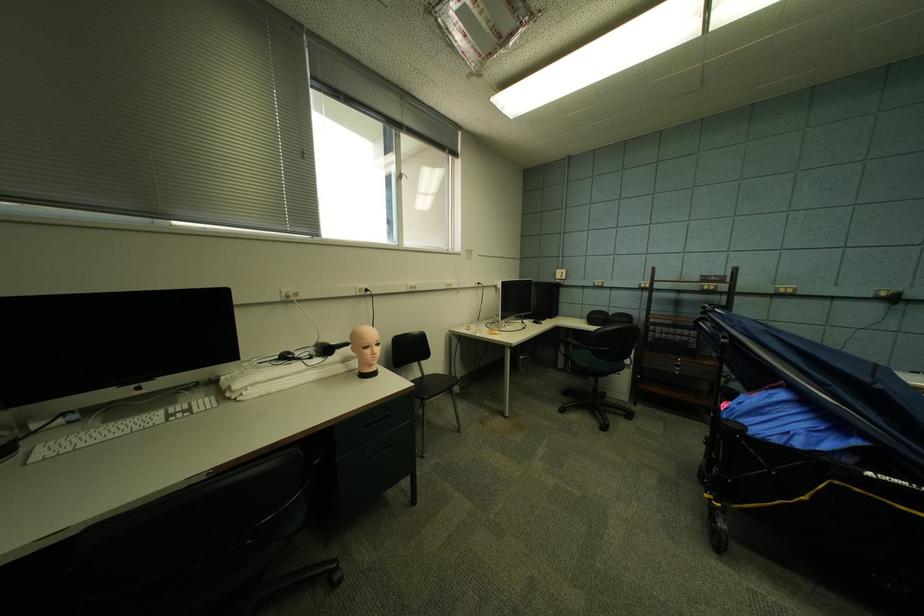
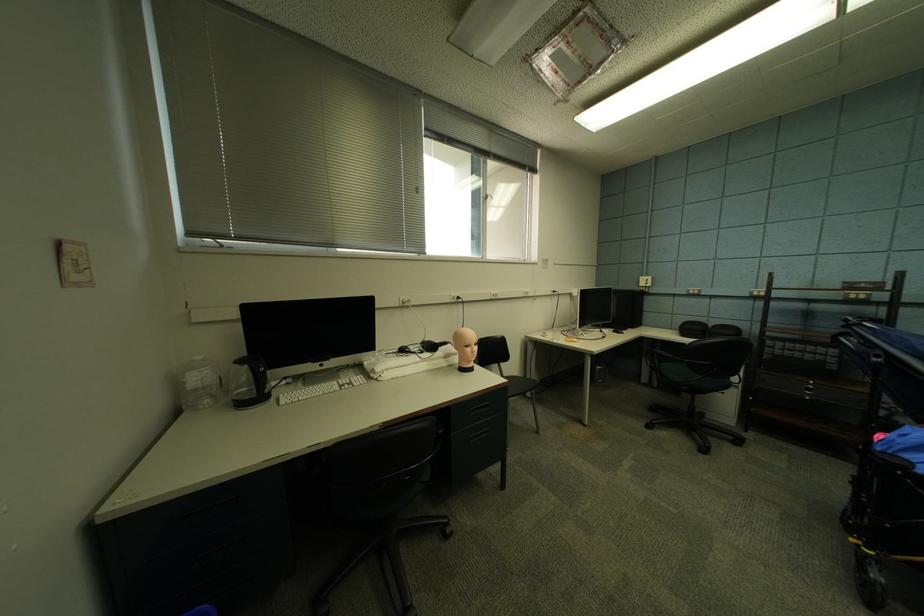
In the second image, find the point that corresponds to [293,297] in the first image.

(409, 302)